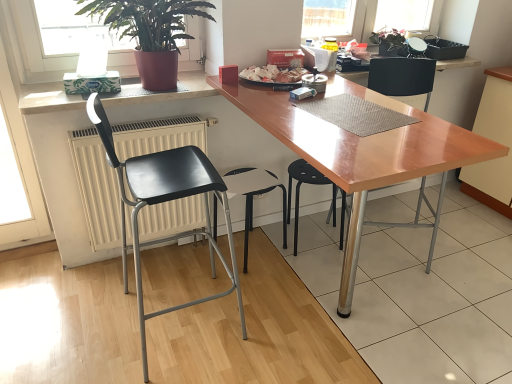
Where is `vacant area situated to the left side of black matte chair at left, the fourth chair viewed from the right`? vacant area situated to the left side of black matte chair at left, the fourth chair viewed from the right is located at coordinates (79, 325).